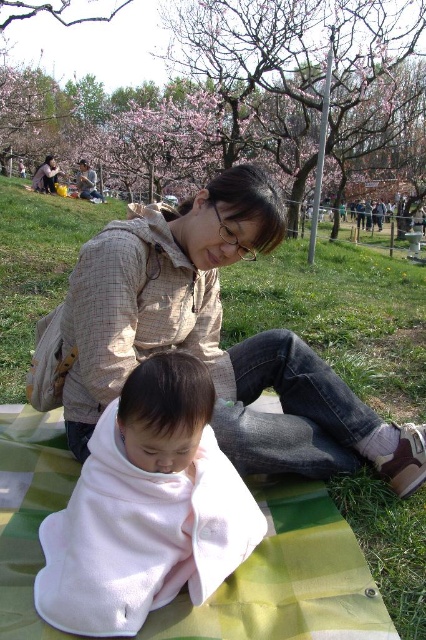
Can you confirm if light brown plaid jacket at center is taller than white fleece blanket at center?

Yes, light brown plaid jacket at center is taller than white fleece blanket at center.

Based on the photo, does light brown plaid jacket at center appear under white fleece blanket at center?

No, light brown plaid jacket at center is not below white fleece blanket at center.

Does point (270, 234) lie behind point (201, 468)?

Yes.

The image size is (426, 640). Find the location of `light brown plaid jacket at center`. light brown plaid jacket at center is located at coordinates (218, 339).

Is light brown plaid jacket at center bigger than matte beige jacket at upper left?

No.

Between point (77, 406) and point (43, 180), which one is positioned behind?

The point (43, 180) is more distant.

Which is in front, point (78, 333) or point (48, 193)?

Point (78, 333)

I want to click on light brown plaid jacket at center, so click(218, 339).

Consider the image. Is white fleece blanket at center to the right of matte beige jacket at upper left from the viewer's perspective?

Yes, white fleece blanket at center is to the right of matte beige jacket at upper left.

Find the location of a particular element. white fleece blanket at center is located at coordinates (146, 508).